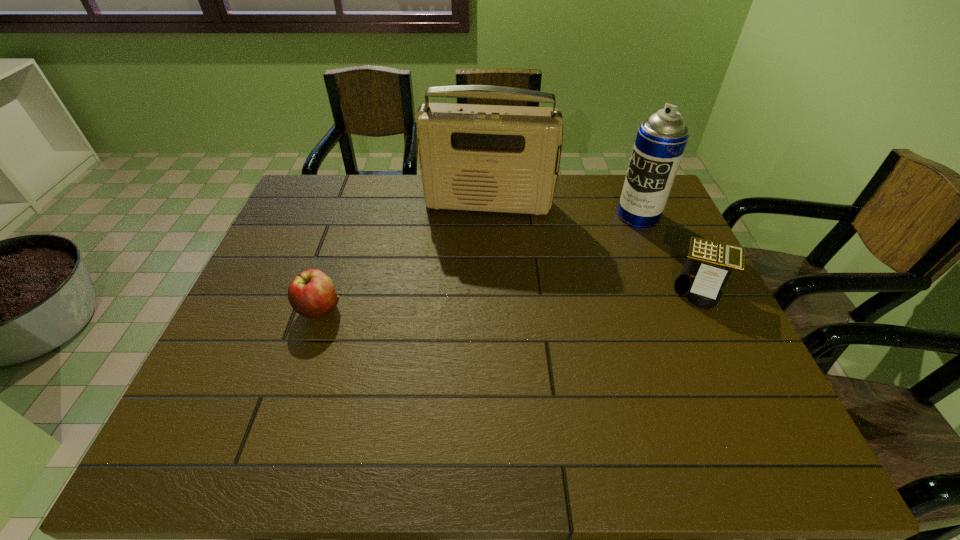
This screenshot has height=540, width=960. I want to click on apple, so click(311, 293).

Locate an element on the screen. calculator is located at coordinates (709, 264).

Identify the location of aerosol can. (661, 140).

This screenshot has width=960, height=540. Find the location of `the second object from left to right`. the second object from left to right is located at coordinates (493, 158).

Locate an element on the screen. free space located 0.330m on the back of the leftmost object is located at coordinates (351, 215).

In order to click on vacant space located 0.160m on the back of the calculator in this screenshot , I will do `click(674, 231)`.

Where is `blank area located on the label side of the aerosol can`? The width and height of the screenshot is (960, 540). blank area located on the label side of the aerosol can is located at coordinates (591, 255).

This screenshot has width=960, height=540. In order to click on blank space located on the label side of the aerosol can in this screenshot , I will do `click(600, 248)`.

Where is `vacant space positioned on the label side of the aerosol can`? The image size is (960, 540). vacant space positioned on the label side of the aerosol can is located at coordinates (604, 245).

The width and height of the screenshot is (960, 540). I want to click on blank space located 0.280m on the front-facing side of the radio receiver, so pyautogui.click(x=474, y=284).